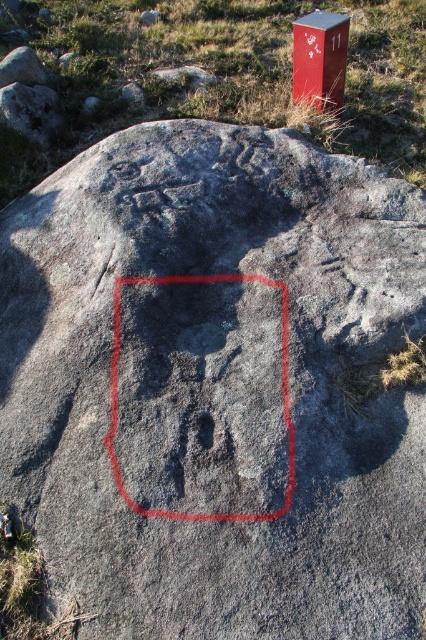
Consider the image. You are an archaeologist examining the rock surface and notice the gray stone carving at center and the metallic red mailbox at upper right. Which object is wider according to the description provided?

The gray stone carving at center might be wider than metallic red mailbox at upper right according to the description provided.

You are an archaeologist examining the rock carvings. You need to take a photo of the gray stone carving at center and the metallic red mailbox at upper right. Which object should you focus on first to ensure both are in frame without moving the camera?

The gray stone carving at center is closer to the viewer than the metallic red mailbox at upper right, so focus on the gray stone carving at center first to ensure both are in frame without moving the camera.

You are an archaeologist examining the rock carvings. You notice two points marked on the rock surface. The first point is at coordinates point (124,486) and the second is at point (337,68). Based on the carvings and your current position, which point is closer to you?

Point (124,486) is in front of point (337,68), so it is closer to you.